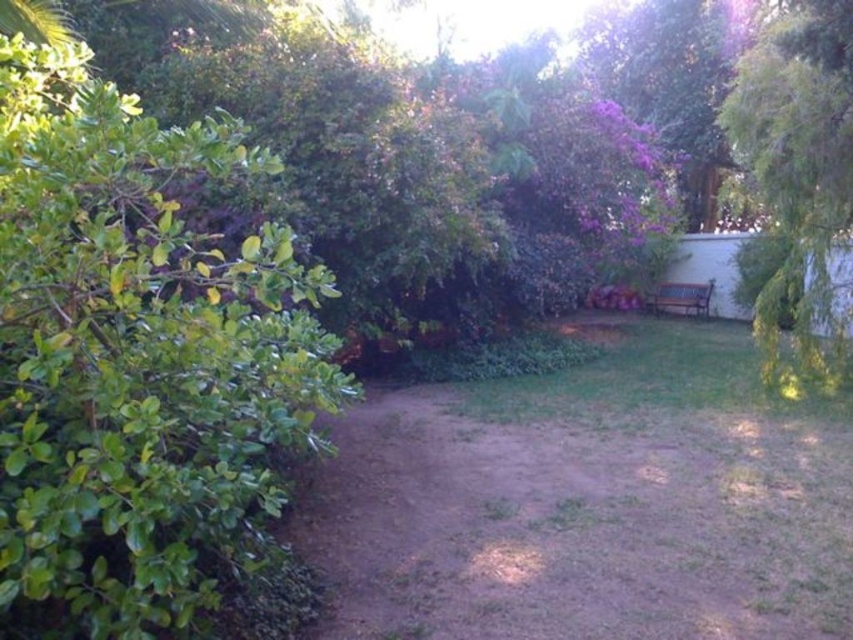
Question: Can you confirm if dirt path at center is positioned to the right of green leafy tree at right?

Choices:
 (A) yes
 (B) no

Answer: (B)

Question: Is dirt path at center below green leafy tree at right?

Choices:
 (A) no
 (B) yes

Answer: (B)

Question: Among these objects, which one is nearest to the camera?

Choices:
 (A) dirt path at center
 (B) green leafy bush at left

Answer: (B)

Question: Is dirt path at center below green leafy tree at right?

Choices:
 (A) yes
 (B) no

Answer: (A)

Question: Which point is farther from the camera taking this photo?

Choices:
 (A) (62, 323)
 (B) (438, 531)

Answer: (B)

Question: Which object is closer to the camera taking this photo?

Choices:
 (A) dirt path at center
 (B) green leafy bush at left
 (C) green leafy tree at right

Answer: (B)